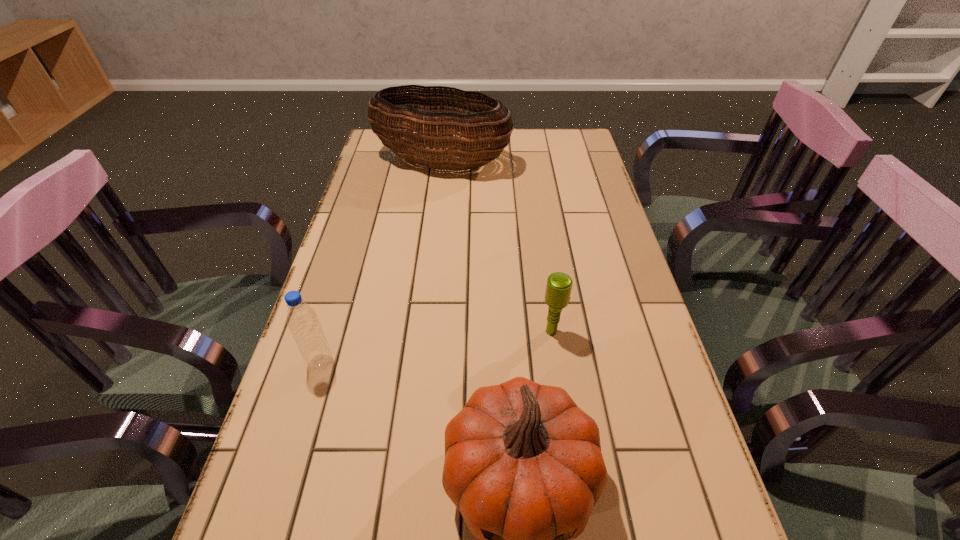
I want to click on basket, so click(x=435, y=128).

Find the location of a particular element. This screenshot has height=540, width=960. the second nearest object is located at coordinates (302, 320).

Where is `the shortest object`? The width and height of the screenshot is (960, 540). the shortest object is located at coordinates (558, 289).

I want to click on microphone, so click(558, 289).

The width and height of the screenshot is (960, 540). What are the coordinates of `vacant space located 0.310m on the front of the basket` in the screenshot? It's located at (432, 246).

Find the location of a particular element. This screenshot has height=540, width=960. free point located on the right of the water bottle is located at coordinates (418, 363).

Image resolution: width=960 pixels, height=540 pixels. What are the coordinates of `vacant space positioned 0.070m on the left of the microphone` in the screenshot? It's located at (510, 332).

Image resolution: width=960 pixels, height=540 pixels. Identify the location of object that is at the far edge. (435, 128).

I want to click on basket at the left edge, so click(435, 128).

You are a GUI agent. You are given a task and a screenshot of the screen. Output one action in this format:
    pyautogui.click(x=<x>, y=<y>)
    Task: Click on the water bottle that is at the left edge
    This screenshot has width=960, height=540.
    Given the screenshot: What is the action you would take?
    pyautogui.click(x=302, y=320)